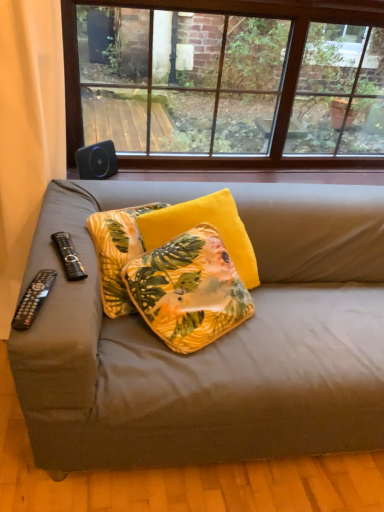
What are the coordinates of `free space behind black plastic remote at left, placed as the second remote control when sorted from bottom to top` in the screenshot? It's located at (88, 220).